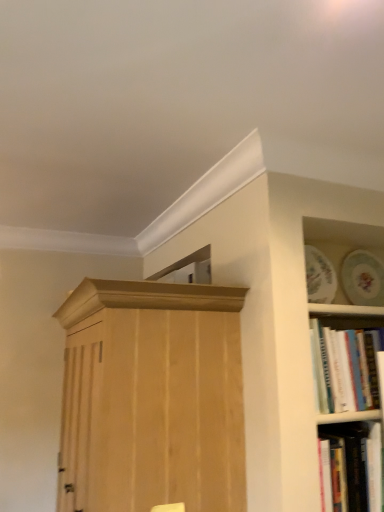
Find the location of a particular element. The image size is (384, 512). white paperbacks at right, placed as the first book when sorted from top to bottom is located at coordinates (344, 368).

Where is `hardcover book at lower right, marked as the first book in a bottom-to-top arrangement`? This screenshot has width=384, height=512. hardcover book at lower right, marked as the first book in a bottom-to-top arrangement is located at coordinates point(351,467).

Based on the photo, between hardcover book at lower right, marked as the first book in a bottom-to-top arrangement, and white paperbacks at right, the 2th book from the bottom, which one has smaller size?

white paperbacks at right, the 2th book from the bottom.

From the picture: Can you confirm if hardcover book at lower right, which is the 2th book in top-to-bottom order, is shorter than white paperbacks at right, placed as the first book when sorted from top to bottom?

Yes, hardcover book at lower right, which is the 2th book in top-to-bottom order, is shorter than white paperbacks at right, placed as the first book when sorted from top to bottom.

What are the coordinates of `book that is under the white paperbacks at right, the 2th book from the bottom (from a real-world perspective)` in the screenshot? It's located at (351, 467).

From the image's perspective, is hardcover book at lower right, which is the 2th book in top-to-bottom order, located beneath white paperbacks at right, the 2th book from the bottom?

Correct, hardcover book at lower right, which is the 2th book in top-to-bottom order, appears lower than white paperbacks at right, the 2th book from the bottom, in the image.

Is white paperbacks at right, the 2th book from the bottom, with natural wood cupboard at center?

white paperbacks at right, the 2th book from the bottom, and natural wood cupboard at center are not in contact.

From the image's perspective, is white paperbacks at right, placed as the first book when sorted from top to bottom, on natural wood cupboard at center?

Yes.

Is white paperbacks at right, the 2th book from the bottom, further to the viewer compared to natural wood cupboard at center?

Yes, it is.

Can we say white paperbacks at right, placed as the first book when sorted from top to bottom, lies outside natural wood cupboard at center?

Absolutely, white paperbacks at right, placed as the first book when sorted from top to bottom, is external to natural wood cupboard at center.

Which of these two, natural wood cupboard at center or white paperbacks at right, the 2th book from the bottom, is thinner?

Thinner between the two is white paperbacks at right, the 2th book from the bottom.

Considering the relative sizes of natural wood cupboard at center and white paperbacks at right, the 2th book from the bottom, in the image provided, is natural wood cupboard at center smaller than white paperbacks at right, the 2th book from the bottom,?

Incorrect, natural wood cupboard at center is not smaller in size than white paperbacks at right, the 2th book from the bottom.

Looking at this image, is natural wood cupboard at center in contact with white paperbacks at right, the 2th book from the bottom?

natural wood cupboard at center is not next to white paperbacks at right, the 2th book from the bottom, and they're not touching.

Is natural wood cupboard at center turned away from hardcover book at lower right, which is the 2th book in top-to-bottom order?

Yes, natural wood cupboard at center's orientation is away from hardcover book at lower right, which is the 2th book in top-to-bottom order.

Between natural wood cupboard at center and hardcover book at lower right, which is the 2th book in top-to-bottom order, which one has smaller size?

hardcover book at lower right, which is the 2th book in top-to-bottom order, is smaller.

You are a GUI agent. You are given a task and a screenshot of the screen. Output one action in this format:
    pyautogui.click(x=<x>, y=<y>)
    Task: Click on the 1st book behind the natural wood cupboard at center
    The height and width of the screenshot is (512, 384).
    Given the screenshot: What is the action you would take?
    pyautogui.click(x=351, y=467)

From the image's perspective, which is above, natural wood cupboard at center or hardcover book at lower right, which is the 2th book in top-to-bottom order?

natural wood cupboard at center, from the image's perspective.

Considering the relative positions of hardcover book at lower right, marked as the first book in a bottom-to-top arrangement, and natural wood cupboard at center in the image provided, is hardcover book at lower right, marked as the first book in a bottom-to-top arrangement, to the left of natural wood cupboard at center from the viewer's perspective?

In fact, hardcover book at lower right, marked as the first book in a bottom-to-top arrangement, is to the right of natural wood cupboard at center.

From the image's perspective, would you say hardcover book at lower right, marked as the first book in a bottom-to-top arrangement, is positioned over natural wood cupboard at center?

No, from the image's perspective, hardcover book at lower right, marked as the first book in a bottom-to-top arrangement, is not over natural wood cupboard at center.

Considering the sizes of objects hardcover book at lower right, marked as the first book in a bottom-to-top arrangement, and natural wood cupboard at center in the image provided, who is bigger, hardcover book at lower right, marked as the first book in a bottom-to-top arrangement, or natural wood cupboard at center?

With larger size is natural wood cupboard at center.

Can hardcover book at lower right, which is the 2th book in top-to-bottom order, be found inside white paperbacks at right, placed as the first book when sorted from top to bottom?

No, hardcover book at lower right, which is the 2th book in top-to-bottom order, is not inside white paperbacks at right, placed as the first book when sorted from top to bottom.

Could you tell me if white paperbacks at right, placed as the first book when sorted from top to bottom, is turned towards hardcover book at lower right, marked as the first book in a bottom-to-top arrangement?

No.

From the image's perspective, is white paperbacks at right, placed as the first book when sorted from top to bottom, located above or below hardcover book at lower right, which is the 2th book in top-to-bottom order?

white paperbacks at right, placed as the first book when sorted from top to bottom, is above hardcover book at lower right, which is the 2th book in top-to-bottom order.

Can you see white paperbacks at right, placed as the first book when sorted from top to bottom, touching hardcover book at lower right, marked as the first book in a bottom-to-top arrangement?

No, white paperbacks at right, placed as the first book when sorted from top to bottom, is not next to hardcover book at lower right, marked as the first book in a bottom-to-top arrangement.

Identify the location of book behind the hardcover book at lower right, which is the 2th book in top-to-bottom order. (344, 368).

Locate an element on the screen. cupboard that is on the left side of white paperbacks at right, the 2th book from the bottom is located at coordinates (152, 397).

Based on their spatial positions, is natural wood cupboard at center or hardcover book at lower right, marked as the first book in a bottom-to-top arrangement, further from white paperbacks at right, placed as the first book when sorted from top to bottom?

Among the two, natural wood cupboard at center is located further to white paperbacks at right, placed as the first book when sorted from top to bottom.

Based on their spatial positions, is natural wood cupboard at center or white paperbacks at right, placed as the first book when sorted from top to bottom, closer to hardcover book at lower right, marked as the first book in a bottom-to-top arrangement?

white paperbacks at right, placed as the first book when sorted from top to bottom, is positioned closer to the anchor hardcover book at lower right, marked as the first book in a bottom-to-top arrangement.

From the image, which object appears to be farther from natural wood cupboard at center, hardcover book at lower right, which is the 2th book in top-to-bottom order, or white paperbacks at right, the 2th book from the bottom?

hardcover book at lower right, which is the 2th book in top-to-bottom order.

Looking at the image, which one is located further to natural wood cupboard at center, white paperbacks at right, the 2th book from the bottom, or hardcover book at lower right, marked as the first book in a bottom-to-top arrangement?

hardcover book at lower right, marked as the first book in a bottom-to-top arrangement, is positioned further to the anchor natural wood cupboard at center.

From the image, which object appears to be nearer to hardcover book at lower right, which is the 2th book in top-to-bottom order, white paperbacks at right, placed as the first book when sorted from top to bottom, or natural wood cupboard at center?

white paperbacks at right, placed as the first book when sorted from top to bottom, lies closer to hardcover book at lower right, which is the 2th book in top-to-bottom order, than the other object.

When comparing their distances from white paperbacks at right, the 2th book from the bottom, does hardcover book at lower right, which is the 2th book in top-to-bottom order, or natural wood cupboard at center seem further?

Based on the image, natural wood cupboard at center appears to be further to white paperbacks at right, the 2th book from the bottom.

Where is `book between natural wood cupboard at center and white paperbacks at right, placed as the first book when sorted from top to bottom`? The height and width of the screenshot is (512, 384). book between natural wood cupboard at center and white paperbacks at right, placed as the first book when sorted from top to bottom is located at coordinates (351, 467).